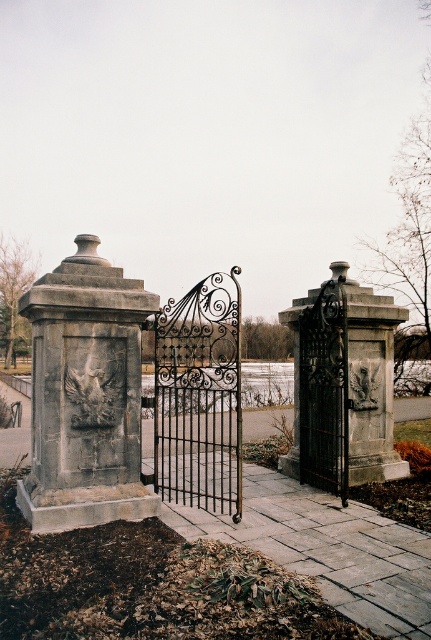
Who is lower down, stone textured gate at right or black wrought iron gate at center?

black wrought iron gate at center is lower down.

Does stone textured gate at right appear over black wrought iron gate at center?

Indeed, stone textured gate at right is positioned over black wrought iron gate at center.

Does point (380, 468) come farther from viewer compared to point (172, 374)?

Yes, it is behind point (172, 374).

This screenshot has height=640, width=431. Find the location of `stone textured gate at right`. stone textured gate at right is located at coordinates (343, 385).

Find the location of a particular element. This screenshot has width=431, height=640. gray stone monument at left is located at coordinates (86, 394).

Between gray stone monument at left and stone textured gate at right, which one is positioned higher?

Positioned higher is gray stone monument at left.

Which is behind, point (69, 288) or point (372, 355)?

Point (372, 355)

Where is `gray stone monument at left`? gray stone monument at left is located at coordinates (86, 394).

Is point (71, 416) more distant than point (221, 506)?

No, it is not.

Is gray stone monument at left further to camera compared to black wrought iron gate at center?

No, it is not.

Measure the distance between point [118,412] and camera.

Point [118,412] and camera are 19.28 feet apart from each other.

The height and width of the screenshot is (640, 431). Identify the location of gray stone monument at left. (86, 394).